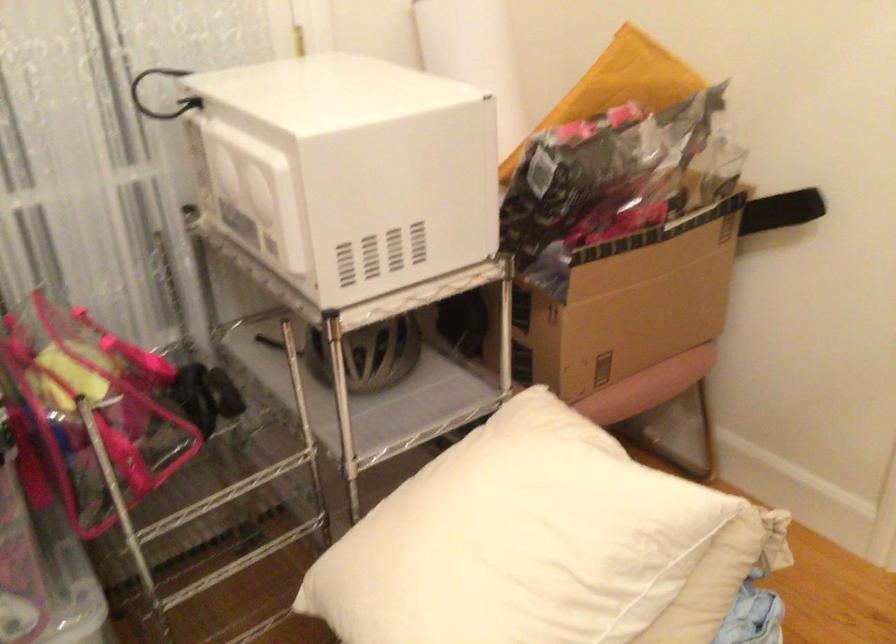
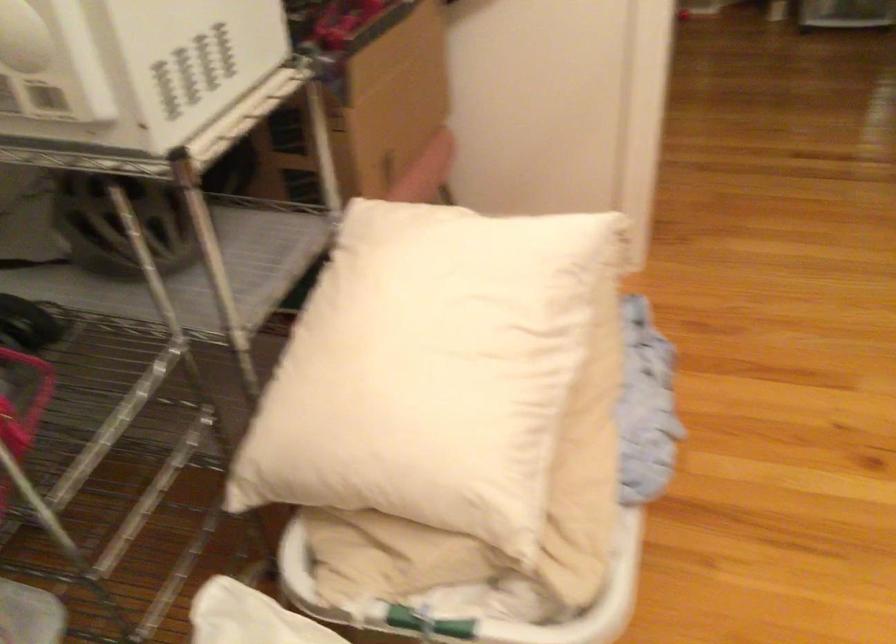
Question: How did the camera likely rotate?

Choices:
 (A) Left
 (B) Right
 (C) Up
 (D) Down

Answer: (B)